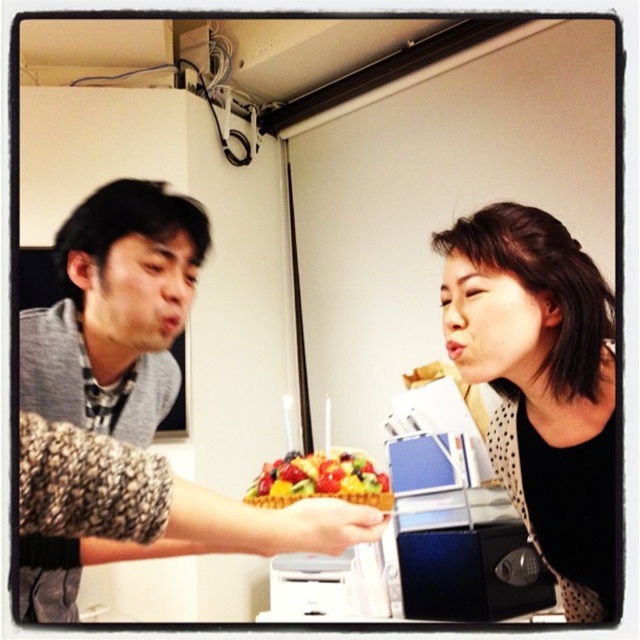
Is matte black laptop at left taller than glossy plastic fruit salad at center?

Correct, matte black laptop at left is much taller as glossy plastic fruit salad at center.

Does matte black laptop at left have a lesser width compared to glossy plastic fruit salad at center?

Incorrect, matte black laptop at left's width is not less than glossy plastic fruit salad at center's.

The height and width of the screenshot is (640, 640). I want to click on matte black laptop at left, so [x=541, y=385].

Which is above, matte black laptop at left or black dotted blouse at right?

black dotted blouse at right is above.

The width and height of the screenshot is (640, 640). Describe the element at coordinates (541, 385) in the screenshot. I see `matte black laptop at left` at that location.

Is point (588, 582) farther from viewer compared to point (518, 452)?

That is False.

I want to click on matte black laptop at left, so click(541, 385).

Who is taller, black dotted blouse at right or gray knitted sweater at left?

gray knitted sweater at left is taller.

Identify the location of black dotted blouse at right. This screenshot has height=640, width=640. (541, 385).

This screenshot has width=640, height=640. Find the location of `black dotted blouse at right`. black dotted blouse at right is located at coordinates (541, 385).

Find the location of a particular element. This screenshot has width=640, height=640. black dotted blouse at right is located at coordinates (541, 385).